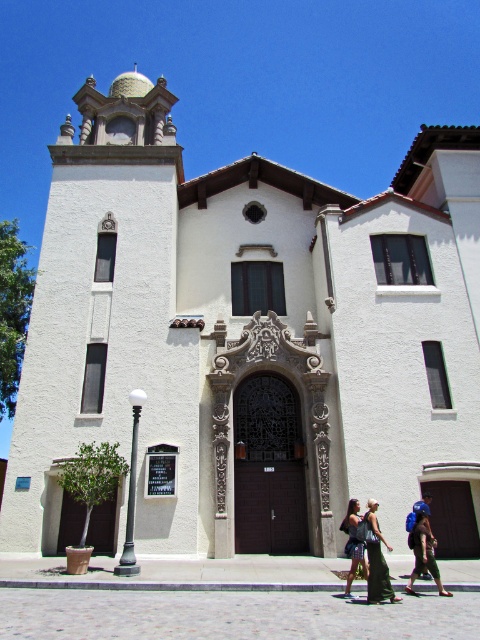
Question: Is green fabric dress at lower center bigger than dark blue denim jeans at center?

Choices:
 (A) no
 (B) yes

Answer: (A)

Question: Among these objects, which one is nearest to the camera?

Choices:
 (A) dark blue denim jeans at center
 (B) blue fabric backpack at center
 (C) blue backpack at center

Answer: (B)

Question: Which point is closer to the camera taking this photo?

Choices:
 (A) (376, 532)
 (B) (428, 572)
 (C) (348, 508)
 (D) (409, 588)

Answer: (A)

Question: Does green fabric dress at lower center have a lesser width compared to dark blue denim jeans at center?

Choices:
 (A) no
 (B) yes

Answer: (B)

Question: Which object is the closest to the dark blue denim jeans at center?

Choices:
 (A) blue fabric backpack at center
 (B) blue backpack at center
 (C) green fabric dress at lower center

Answer: (C)

Question: Does green fabric dress at lower center have a larger size compared to blue backpack at center?

Choices:
 (A) no
 (B) yes

Answer: (B)